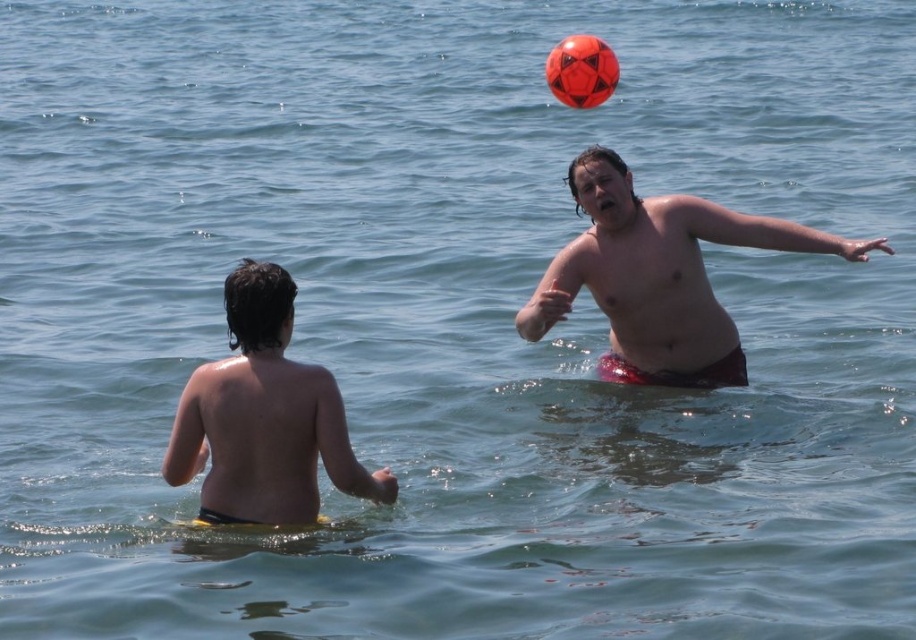
You are a photographer trying to capture a candid shot of the smooth red shorts at right and the smooth skin child at center. If you want to ensure both subjects are in focus, which one should you focus on first based on their positions?

The smooth skin child at center is behind the smooth red shorts at right, so you should focus on the smooth red shorts at right first to ensure both are in focus.

You are designing a storage box for the smooth red shorts at right and the rubber ball at upper center. The box must fit both items without overlapping. Based on the scene description, which item requires a wider compartment?

The rubber ball at upper center requires a wider compartment since its width is greater than the smooth red shorts at right.

Looking at this image, you are a photographer trying to capture the scene. The point indicating the position of the smooth red shorts at right is located at coordinates (660, 275). If you want to frame the shot so that the smooth red shorts at right is centered in the photo, where should you position your camera? Please provide the coordinates as a point in the format of point followed by coordinates in parentheses.

To center the smooth red shorts at right, position the camera at point (660, 275).